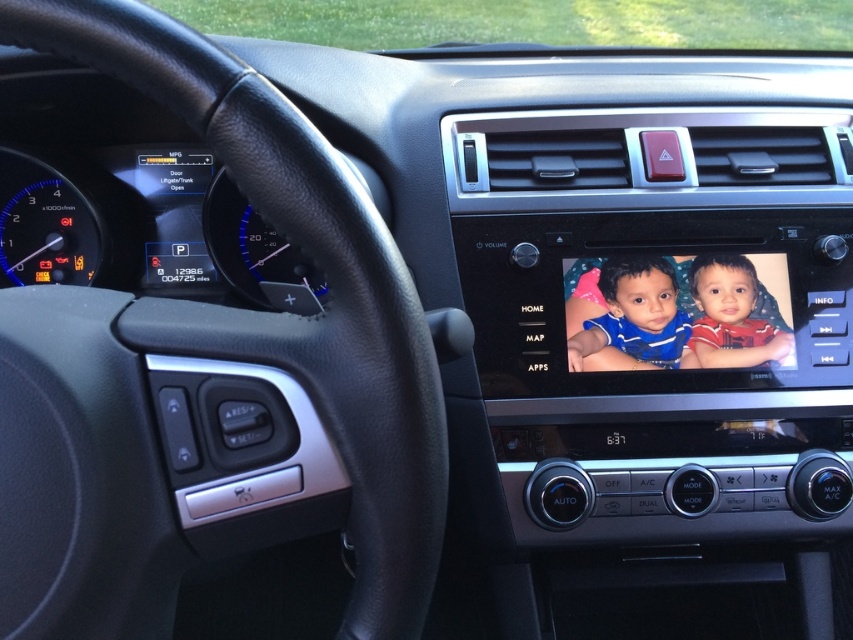
Question: Which object is farther from the camera taking this photo?

Choices:
 (A) matte red shirt at center
 (B) blue fabric baby at center

Answer: (A)

Question: Is blue fabric baby at center closer to the viewer compared to matte red shirt at center?

Choices:
 (A) yes
 (B) no

Answer: (A)

Question: Is blue fabric baby at center above matte red shirt at center?

Choices:
 (A) yes
 (B) no

Answer: (B)

Question: Can you confirm if blue fabric baby at center is bigger than matte red shirt at center?

Choices:
 (A) no
 (B) yes

Answer: (B)